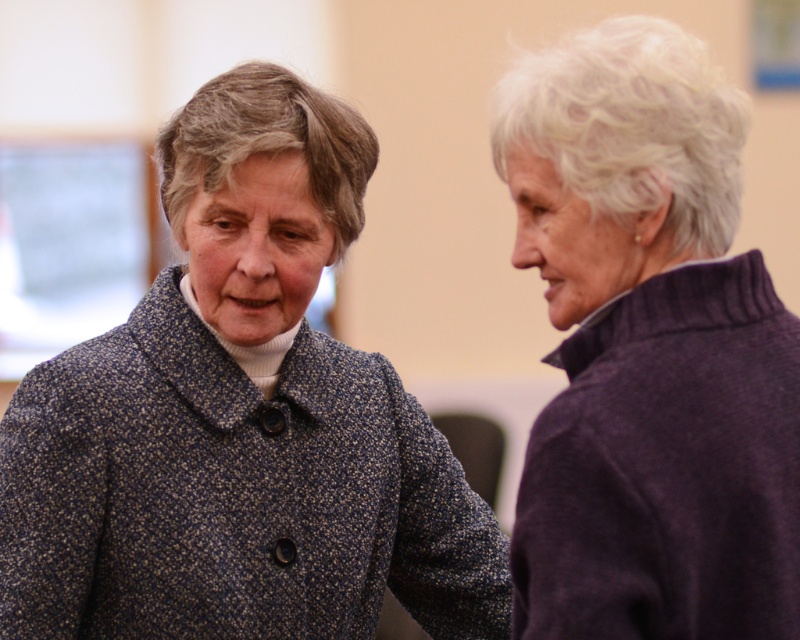
You are a photographer adjusting your camera to focus on two points in the image. The first point is point (93, 614) and the second point is point (612, 632). Which point is closer to you?

Point (93, 614) is closer to you than point (612, 632) because it is further to the viewer.